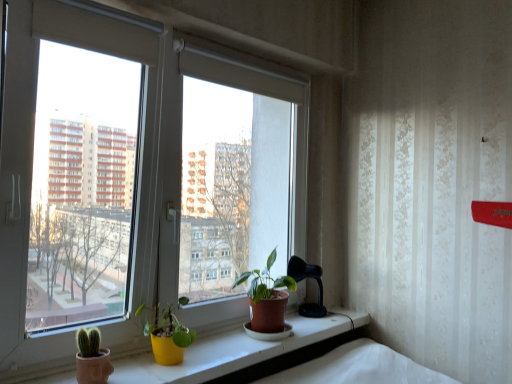
In order to click on vacant point to the left of yellow matte pot at lower center, the first houseplant in the front-to-back sequence in this screenshot , I will do `click(123, 366)`.